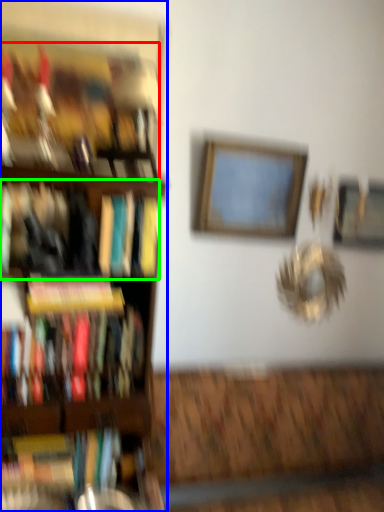
Question: Considering the real-world distances, which object is closest to book (highlighted by a red box)? shelf (highlighted by a blue box) or book (highlighted by a green box).

Choices:
 (A) shelf
 (B) book

Answer: (A)